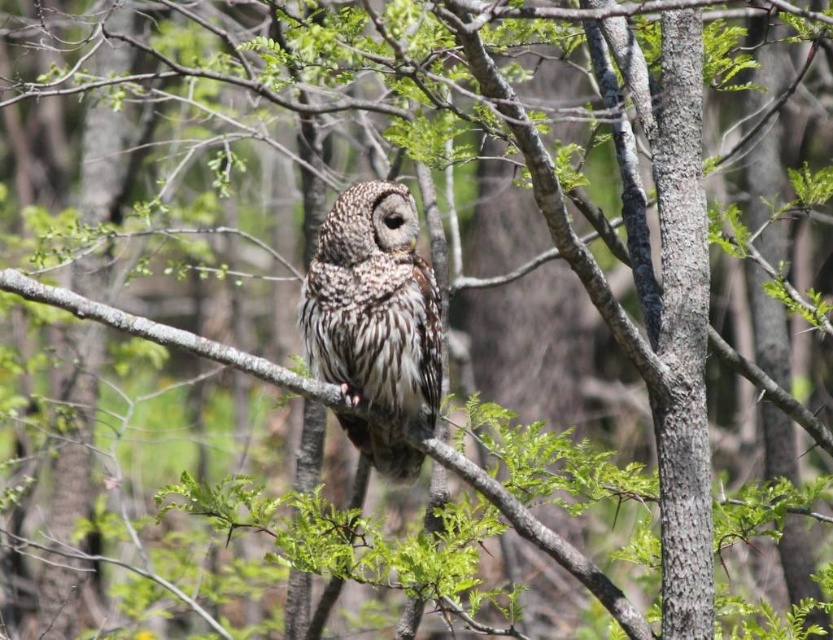
How distant is speckled feathered owl at center from brown textured branch at center?

speckled feathered owl at center is 7.85 inches away from brown textured branch at center.

Who is positioned more to the right, speckled feathered owl at center or brown textured branch at center?

speckled feathered owl at center

Is point (398, 408) farther from viewer compared to point (622, 596)?

No, (398, 408) is in front of (622, 596).

Locate an element on the screen. This screenshot has width=833, height=640. speckled feathered owl at center is located at coordinates [x=373, y=305].